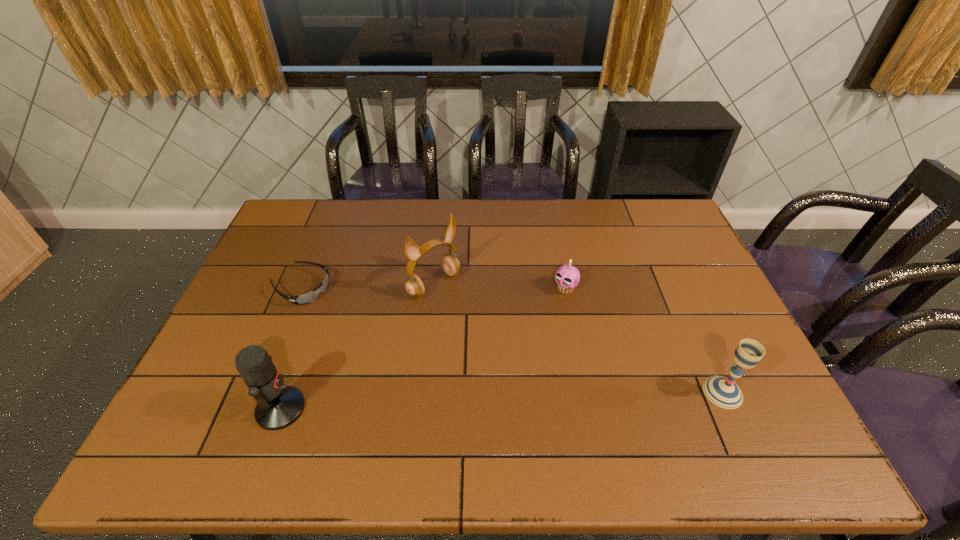
Where is `free spot between the fourth tallest object and the earphone`? The width and height of the screenshot is (960, 540). free spot between the fourth tallest object and the earphone is located at coordinates (500, 286).

Where is `empty space that is in between the third object from right to left and the microphone`? empty space that is in between the third object from right to left and the microphone is located at coordinates (357, 347).

Identify the location of vacant area between the sunglasses and the fourth tallest object. pos(434,288).

Image resolution: width=960 pixels, height=540 pixels. What are the coordinates of `free space that is in between the fourth tallest object and the sunglasses` in the screenshot? It's located at (434, 288).

Find the location of `unoccupied area between the second object from right to left and the sunglasses`. unoccupied area between the second object from right to left and the sunglasses is located at coordinates (434, 288).

Find the location of a particular element. The height and width of the screenshot is (540, 960). free spot between the earphone and the second object from right to left is located at coordinates (500, 286).

The width and height of the screenshot is (960, 540). What are the coordinates of `empty location between the shortest object and the third shortest object` in the screenshot? It's located at (512, 340).

Where is `free point between the cupcake and the microphone`? The image size is (960, 540). free point between the cupcake and the microphone is located at coordinates (423, 349).

Identify which object is the second nearest to the third shortest object. Please provide its 2D coordinates. Your answer should be formatted as a tuple, i.e. [(x, y)], where the tuple contains the x and y coordinates of a point satisfying the conditions above.

[(414, 286)]

Locate which object ranks second in proximity to the earphone. Please provide its 2D coordinates. Your answer should be formatted as a tuple, i.e. [(x, y)], where the tuple contains the x and y coordinates of a point satisfying the conditions above.

[(567, 277)]